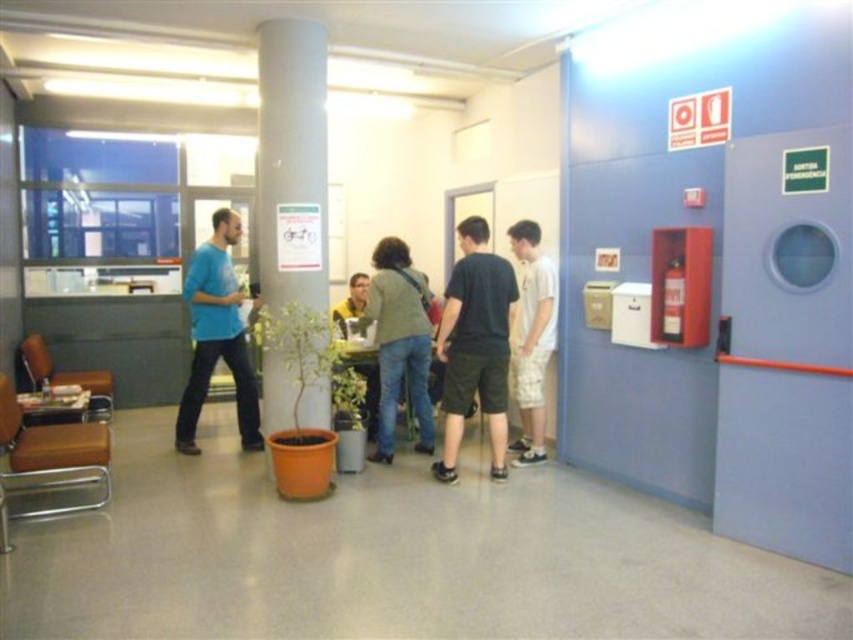
Which is more to the right, denim jeans at center or white cotton shirt at right?

white cotton shirt at right

Between point (399, 392) and point (532, 436), which one is positioned behind?

The point (399, 392) is behind.

Locate an element on the screen. This screenshot has height=640, width=853. denim jeans at center is located at coordinates click(399, 342).

Does blue cotton shirt at center appear on the right side of yellow shirt at center?

No, blue cotton shirt at center is not to the right of yellow shirt at center.

Describe the element at coordinates (216, 336) in the screenshot. I see `blue cotton shirt at center` at that location.

Identify the location of blue cotton shirt at center. (216, 336).

Can you confirm if dark green shorts at center is wider than yellow shirt at center?

Yes.

This screenshot has width=853, height=640. I want to click on dark green shorts at center, so click(474, 346).

Describe the element at coordinates (474, 346) in the screenshot. This screenshot has width=853, height=640. I see `dark green shorts at center` at that location.

The image size is (853, 640). In order to click on dark green shorts at center in this screenshot , I will do `click(474, 346)`.